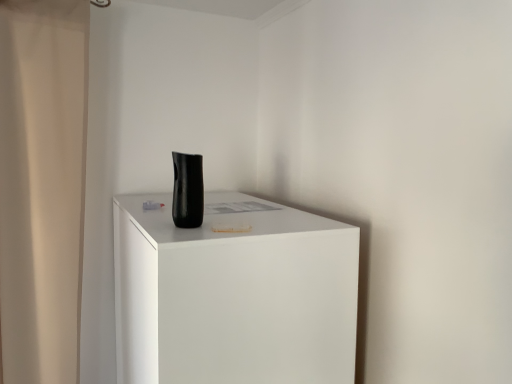
Question: From the image's perspective, relative to black matte vase at center, is beige fabric shower curtain at left above or below?

Choices:
 (A) above
 (B) below

Answer: (B)

Question: Is beige fabric shower curtain at left inside the boundaries of black matte vase at center, or outside?

Choices:
 (A) inside
 (B) outside

Answer: (B)

Question: Based on their relative distances, which object is nearer to the matte black vase at center?

Choices:
 (A) beige fabric shower curtain at left
 (B) black matte vase at center

Answer: (B)

Question: Which of these objects is positioned farthest from the matte black vase at center?

Choices:
 (A) black matte vase at center
 (B) beige fabric shower curtain at left

Answer: (B)